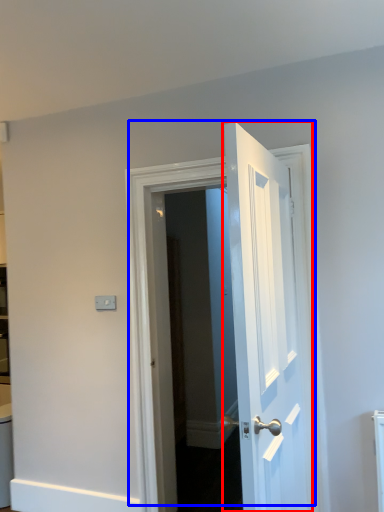
Question: Which object appears farthest to the camera in this image, door (highlighted by a red box) or door (highlighted by a blue box)?

Choices:
 (A) door
 (B) door

Answer: (B)